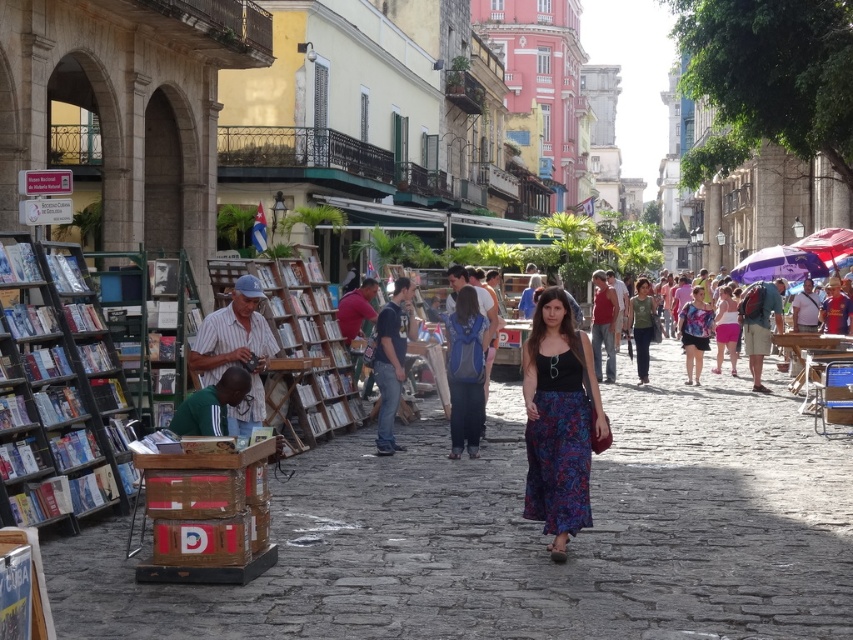
Who is shorter, metallic gray bookshelf at left or floral dress at center?

With less height is floral dress at center.

Does point (35, 486) lie in front of point (695, 340)?

That is True.

At what (x,y) coordinates should I click in order to perform the action: click on metallic gray bookshelf at left. Please return your answer as a coordinate pair (x, y). Looking at the image, I should click on (57, 390).

Who is taller, wooden bookshelf at center or pink fabric skirt at center?

With more height is pink fabric skirt at center.

You are a GUI agent. You are given a task and a screenshot of the screen. Output one action in this format:
    pyautogui.click(x=<x>, y=<y>)
    Task: Click on the wooden bookshelf at center
    The image size is (853, 640).
    Given the screenshot: What is the action you would take?
    pyautogui.click(x=299, y=346)

The height and width of the screenshot is (640, 853). I want to click on wooden bookshelf at center, so [x=299, y=346].

You are a GUI agent. You are given a task and a screenshot of the screen. Output one action in this format:
    pyautogui.click(x=<x>, y=<y>)
    Task: Click on the wooden bookshelf at center
    The image size is (853, 640).
    Given the screenshot: What is the action you would take?
    pyautogui.click(x=299, y=346)

Does blue backpack at center have a greater width compared to floral dress at center?

No, blue backpack at center is not wider than floral dress at center.

I want to click on blue backpack at center, so click(x=465, y=371).

Who is more forward, (453, 352) or (685, 362)?

Point (453, 352) is in front.

Find the location of `blue backpack at center`. blue backpack at center is located at coordinates (465, 371).